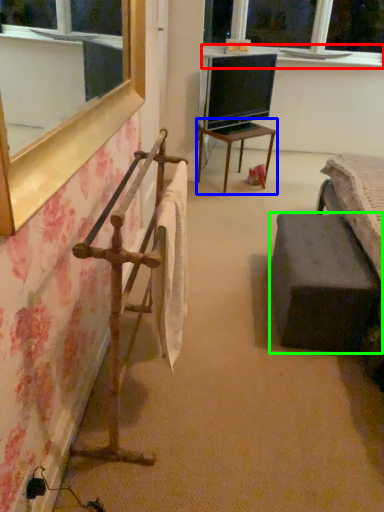
Question: Which object is the closest to the window sill (highlighted by a red box)? Choose among these: table (highlighted by a blue box) or furniture (highlighted by a green box).

Choices:
 (A) table
 (B) furniture

Answer: (A)